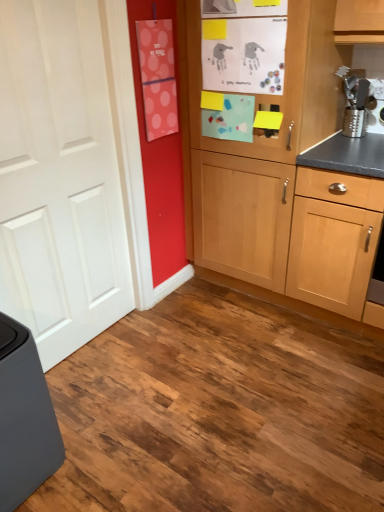
Question: Considering the relative positions of light wood cabinet at center and matte gray trash can at lower left in the image provided, is light wood cabinet at center to the left or to the right of matte gray trash can at lower left?

Choices:
 (A) left
 (B) right

Answer: (B)

Question: Is light wood cabinet at center bigger or smaller than matte gray trash can at lower left?

Choices:
 (A) big
 (B) small

Answer: (A)

Question: Which of these objects is positioned farthest from the white matte door at left?

Choices:
 (A) light wood cabinet at center
 (B) matte gray trash can at lower left
 (C) metallic silver grater at upper right

Answer: (C)

Question: Considering the real-world distances, which object is closest to the metallic silver grater at upper right?

Choices:
 (A) white matte door at left
 (B) matte gray trash can at lower left
 (C) light wood cabinet at center

Answer: (C)